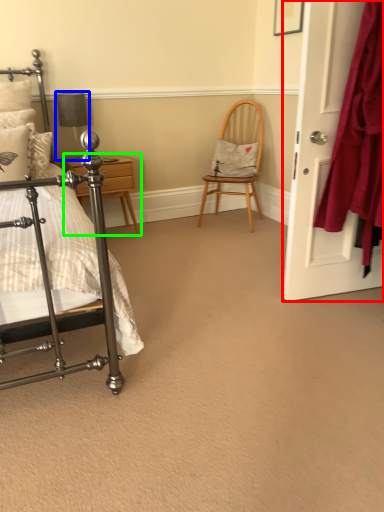
Question: Which object is positioned farthest from door (highlighted by a red box)? Select from table lamp (highlighted by a blue box) and nightstand (highlighted by a green box).

Choices:
 (A) table lamp
 (B) nightstand

Answer: (A)